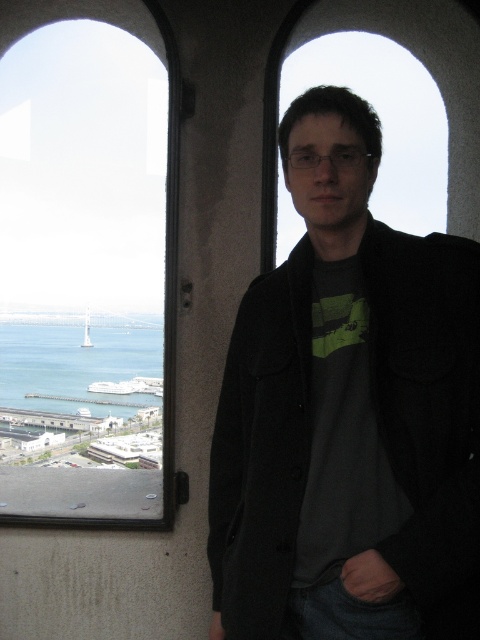
Question: Can you confirm if transparent glass window at upper left is positioned to the left of blue water at lower left?

Choices:
 (A) no
 (B) yes

Answer: (A)

Question: Among these points, which one is nearest to the camera?

Choices:
 (A) (11, 317)
 (B) (87, 394)

Answer: (B)

Question: Can you confirm if transparent glass window at upper left is wider than blue water at lower left?

Choices:
 (A) yes
 (B) no

Answer: (A)

Question: Can you confirm if black woolen jacket at center is positioned to the right of blue water at lower left?

Choices:
 (A) yes
 (B) no

Answer: (A)

Question: Estimate the real-world distances between objects in this image. Which object is farther from the blue water at lower left?

Choices:
 (A) black woolen jacket at center
 (B) transparent glass window at upper left

Answer: (A)

Question: Based on their relative distances, which object is farther from the blue water at lower left?

Choices:
 (A) transparent glass window at upper left
 (B) black woolen jacket at center

Answer: (B)